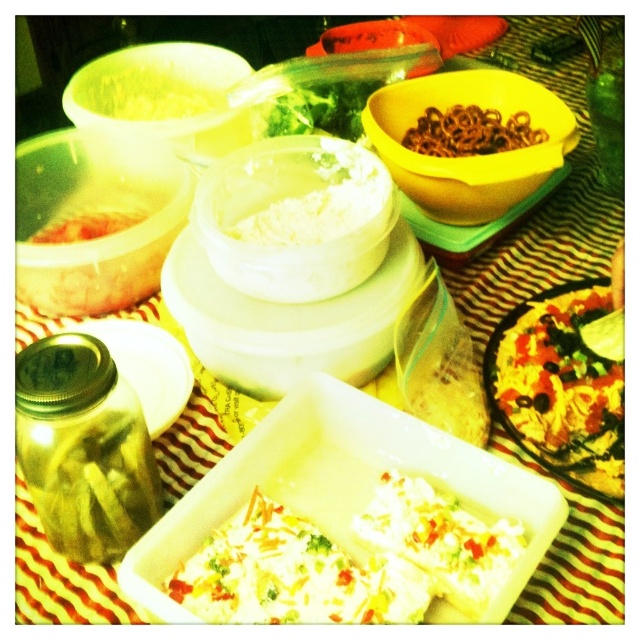
Between white matte powder container at center and translucent plastic bowl at upper left, which one appears on the right side from the viewer's perspective?

From the viewer's perspective, white matte powder container at center appears more on the right side.

Which is above, white matte powder container at center or translucent plastic bowl at upper left?

translucent plastic bowl at upper left is above.

Is point (221, 216) positioned behind point (221, 88)?

That is False.

The image size is (640, 640). Identify the location of white matte powder container at center. (296, 218).

Can you confirm if tomato sauce pizza at right is smaller than translucent plastic bowl at upper left?

Correct, tomato sauce pizza at right occupies less space than translucent plastic bowl at upper left.

Who is higher up, tomato sauce pizza at right or translucent plastic bowl at upper left?

Positioned higher is translucent plastic bowl at upper left.

Which is in front, point (548, 369) or point (100, 77)?

Point (548, 369) is in front.

This screenshot has height=640, width=640. I want to click on tomato sauce pizza at right, so click(560, 385).

The width and height of the screenshot is (640, 640). What do you see at coordinates (442, 540) in the screenshot?
I see `white creamy pasta at center` at bounding box center [442, 540].

Between white creamy pasta at center and white powdery substance at center, which one has less height?

With less height is white creamy pasta at center.

Is point (397, 508) more distant than point (305, 202)?

No.

The width and height of the screenshot is (640, 640). Identify the location of white creamy pasta at center. (442, 540).